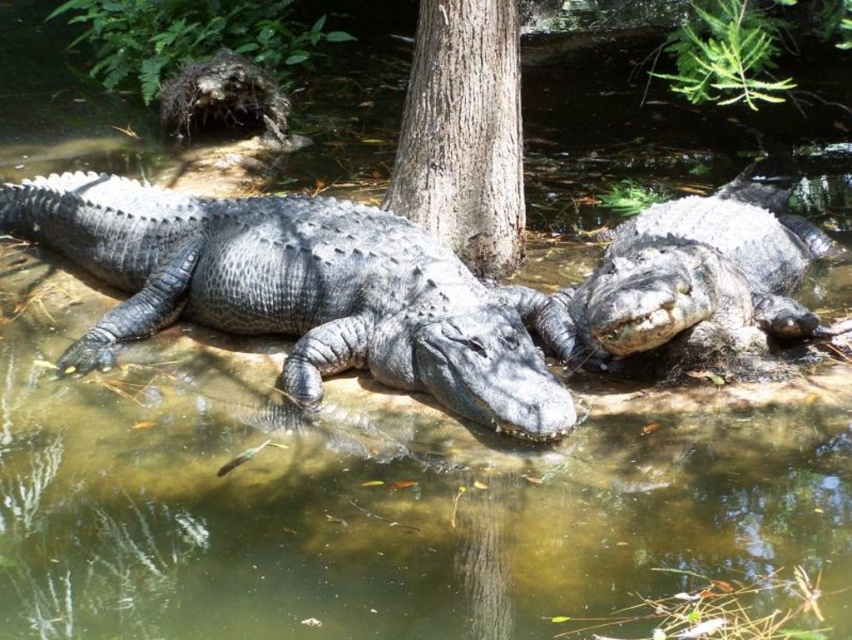
Based on the photo, you are an observer standing on the bank of the river. You see the slick gray crocodile at center and the gray rough skin crocodile at right. Which crocodile is closer to the water surface?

The gray rough skin crocodile at right is closer to the water surface because the slick gray crocodile at center is located below it.

You are a wildlife photographer trying to capture a photo of the gray rough skin crocodile at right and the smooth gray tree trunk at center. Which object is closer to the camera based on their sizes in the image?

The gray rough skin crocodile at right is closer to the camera because it appears smaller than the smooth gray tree trunk at center, which is further away.

You are a wildlife photographer aiming to capture a closeup of both the slick gray crocodile at center and the gray rough skin crocodile at right. Your camera has a 1.5 meter zoom range. Can you get both crocodiles in frame without moving your position?

The slick gray crocodile at center is 1.25 meters from the gray rough skin crocodile at right. Since your camera has a 1.5 meter zoom range, you can capture both crocodiles in frame as the distance between them is within the zoom range.